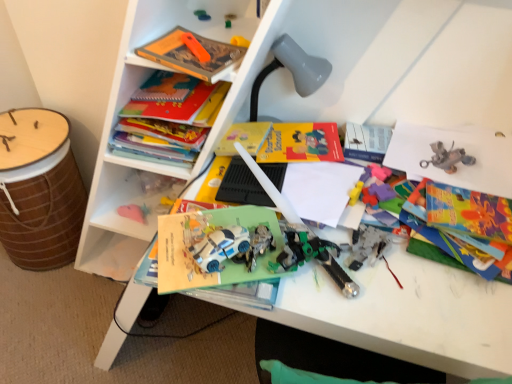
Locate an element on the screen. The height and width of the screenshot is (384, 512). free space in front of brown woven drum at left is located at coordinates (47, 307).